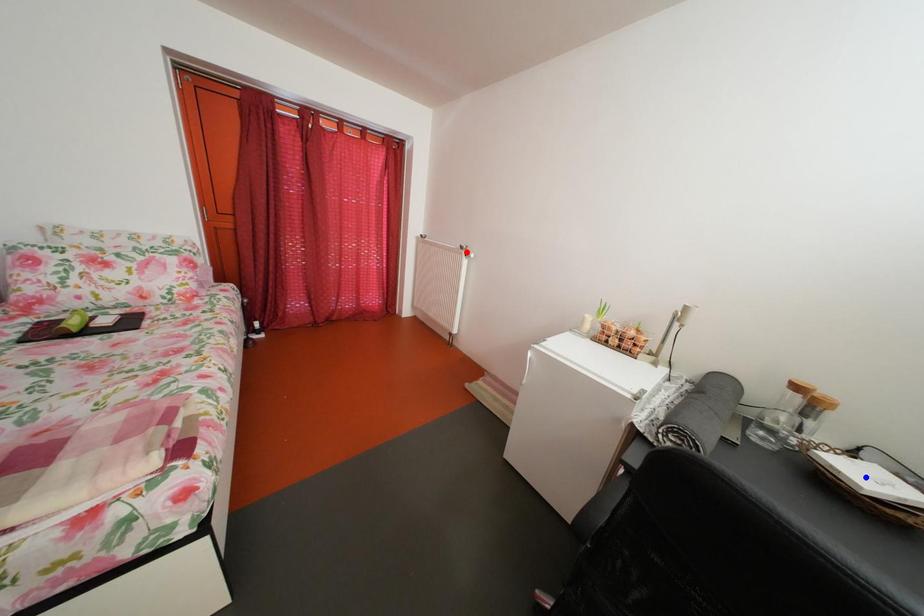
Question: Which of the two points in the image is closer to the camera?

Choices:
 (A) Blue point is closer.
 (B) Red point is closer.

Answer: (A)